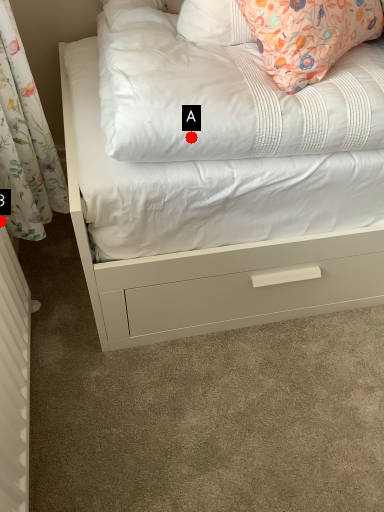
Question: Two points are circled on the image, labeled by A and B beside each circle. Which point appears closest to the camera in this image?

Choices:
 (A) A is closer
 (B) B is closer

Answer: (A)